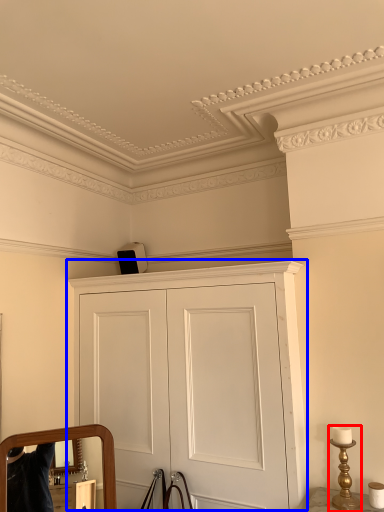
Question: Which object appears closest to the camera in this image, table lamp (highlighted by a red box) or cupboard (highlighted by a blue box)?

Choices:
 (A) table lamp
 (B) cupboard

Answer: (B)